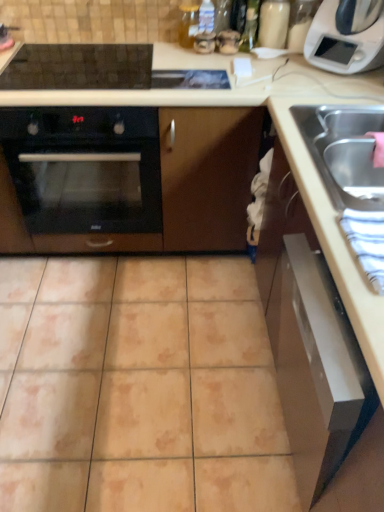
This screenshot has height=512, width=384. Find the location of `vacant area that is in front of white plastic microwave at upper right`. vacant area that is in front of white plastic microwave at upper right is located at coordinates (337, 90).